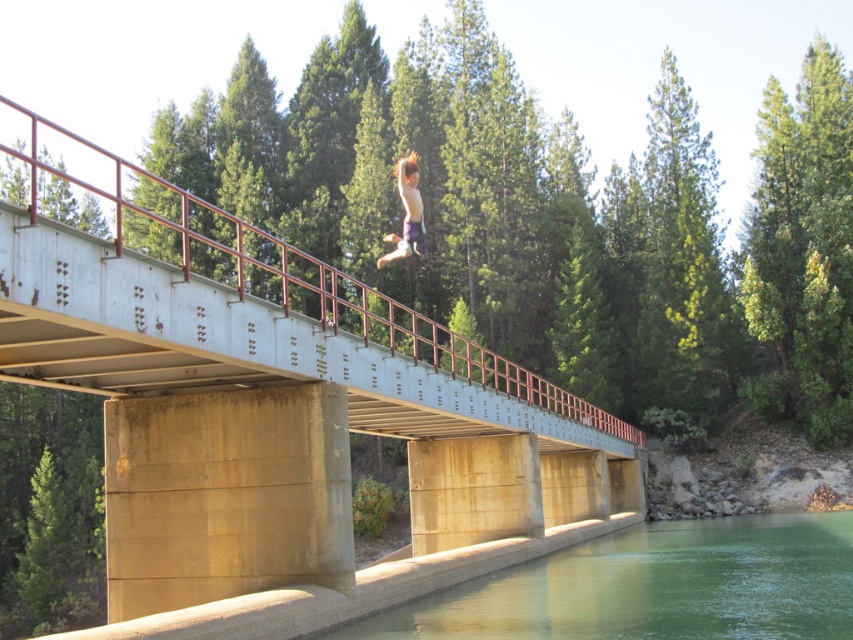
Can you confirm if green smooth water at lower center is positioned below shiny brown hair at center?

Correct, green smooth water at lower center is located below shiny brown hair at center.

Can you confirm if green smooth water at lower center is shorter than shiny brown hair at center?

Yes, green smooth water at lower center is shorter than shiny brown hair at center.

The image size is (853, 640). Identify the location of green smooth water at lower center. (653, 588).

Which is in front, point (19, 156) or point (766, 534)?

Positioned in front is point (19, 156).

Can you confirm if concrete bridge at center is thinner than green smooth water at lower center?

A: In fact, concrete bridge at center might be wider than green smooth water at lower center.

Which is behind, point (325, 412) or point (757, 545)?

The point (757, 545) is more distant.

Where is `concrete bridge at center`? This screenshot has width=853, height=640. concrete bridge at center is located at coordinates (276, 401).

Which of these two, concrete bridge at center or shiny brown hair at center, stands taller?

With more height is concrete bridge at center.

Consider the image. Does concrete bridge at center appear over shiny brown hair at center?

Indeed, concrete bridge at center is positioned over shiny brown hair at center.

Is point (0, 243) positioned behind point (418, 193)?

No.

The height and width of the screenshot is (640, 853). I want to click on concrete bridge at center, so click(276, 401).